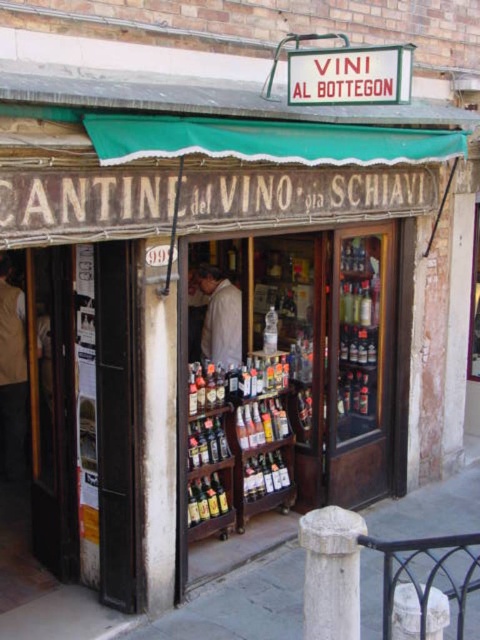
You are a customer entering the wine shop and see the light beige vest at left and the white stone pillar at center. Which object would block your path more if you were to walk straight ahead?

The light beige vest at left would block your path more because it has a larger size compared to the white stone pillar at center.